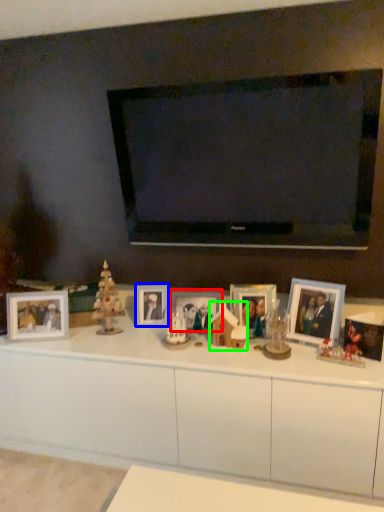
Question: Which is nearer to the picture frame (highlighted by a red box)? picture frame (highlighted by a blue box) or toy (highlighted by a green box).

Choices:
 (A) picture frame
 (B) toy

Answer: (B)